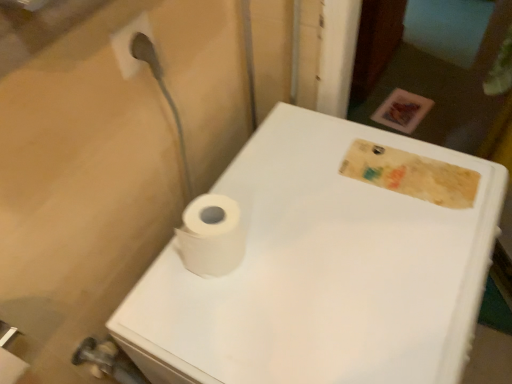
Question: Would you say white matte porcelain at center is outside white matte toilet paper at center?

Choices:
 (A) yes
 (B) no

Answer: (A)

Question: Is white matte porcelain at center touching white matte toilet paper at center?

Choices:
 (A) yes
 (B) no

Answer: (B)

Question: Is white matte porcelain at center aimed at white matte toilet paper at center?

Choices:
 (A) no
 (B) yes

Answer: (A)

Question: From a real-world perspective, is white matte porcelain at center over white matte toilet paper at center?

Choices:
 (A) no
 (B) yes

Answer: (A)

Question: From the image's perspective, is white matte porcelain at center below white matte toilet paper at center?

Choices:
 (A) yes
 (B) no

Answer: (A)

Question: Would you say white matte toilet paper at center is part of white matte porcelain at center's contents?

Choices:
 (A) no
 (B) yes

Answer: (A)

Question: Is white matte toilet paper at center to the left of white matte porcelain at center from the viewer's perspective?

Choices:
 (A) no
 (B) yes

Answer: (B)

Question: Does white matte toilet paper at center lie behind white matte porcelain at center?

Choices:
 (A) no
 (B) yes

Answer: (B)

Question: Is white matte toilet paper at center shorter than white matte porcelain at center?

Choices:
 (A) yes
 (B) no

Answer: (A)

Question: Can you confirm if white matte toilet paper at center is wider than white matte porcelain at center?

Choices:
 (A) yes
 (B) no

Answer: (B)

Question: Does white matte toilet paper at center touch white matte porcelain at center?

Choices:
 (A) no
 (B) yes

Answer: (A)

Question: From the image's perspective, is white matte toilet paper at center on white matte porcelain at center?

Choices:
 (A) no
 (B) yes

Answer: (B)

Question: Does point (273, 301) appear closer or farther from the camera than point (193, 258)?

Choices:
 (A) farther
 (B) closer

Answer: (B)